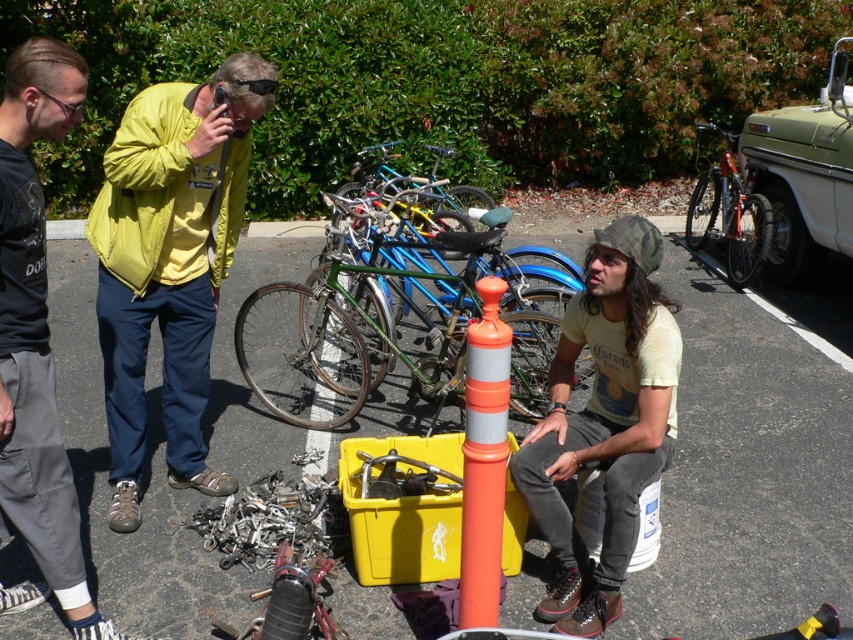
Question: Which object appears farthest from the camera in this image?

Choices:
 (A) orange traffic cone at center
 (B) black cotton shirt at left
 (C) orange plastic traffic cone at center
 (D) blue metallic bicycle at center

Answer: (D)

Question: Is orange traffic cone at center above black cotton shirt at left?

Choices:
 (A) no
 (B) yes

Answer: (A)

Question: Can you confirm if yellow fabric jacket at upper left is bigger than shiny metallic bicycle at center?

Choices:
 (A) no
 (B) yes

Answer: (B)

Question: Which of the following is the farthest from the observer?

Choices:
 (A) (747, 195)
 (B) (334, 353)
 (C) (432, 182)

Answer: (C)

Question: From the image, what is the correct spatial relationship of orange traffic cone at center in relation to orange plastic traffic cone at center?

Choices:
 (A) right
 (B) left

Answer: (A)

Question: Estimate the real-world distances between objects in this image. Which object is closer to the shiny metallic bicycle at center?

Choices:
 (A) blue metallic bicycle at center
 (B) orange traffic cone at center
 (C) orange plastic traffic cone at center

Answer: (A)